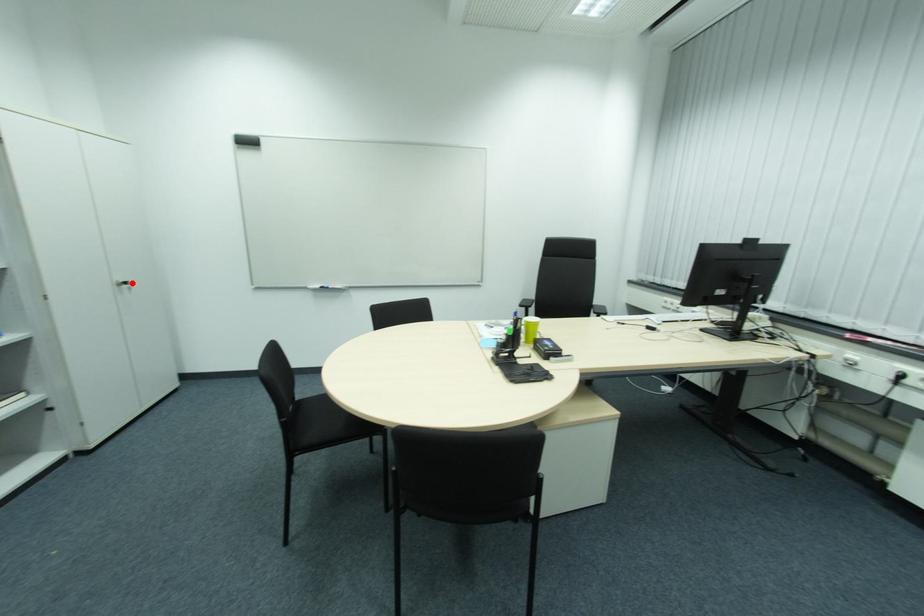
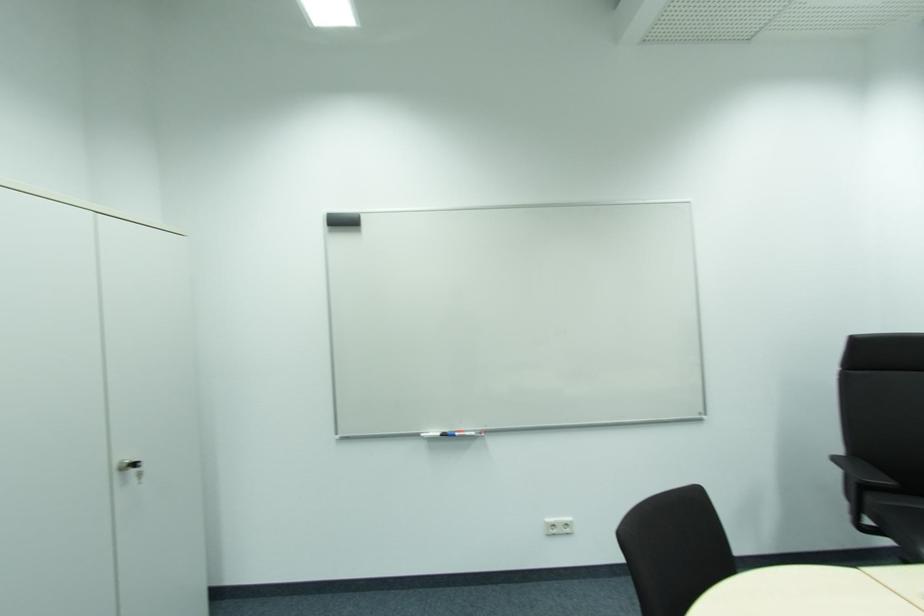
Locate, in the second image, the point that corresponds to the highlighted location in the first image.

(140, 464)